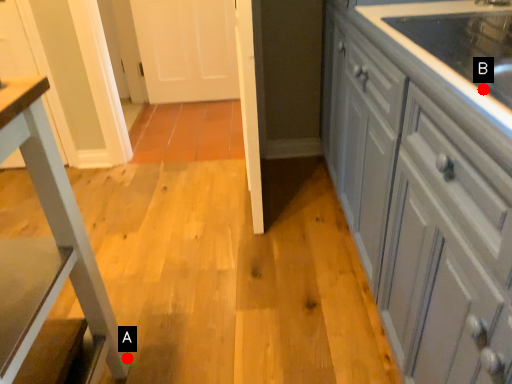
Question: Two points are circled on the image, labeled by A and B beside each circle. Which point appears farthest from the camera in this image?

Choices:
 (A) A is further
 (B) B is further

Answer: (A)